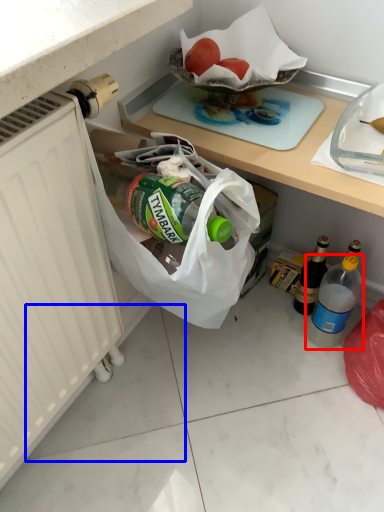
Question: Which of the following is the farthest to the observer, bottle (highlighted by a red box) or tile (highlighted by a blue box)?

Choices:
 (A) bottle
 (B) tile

Answer: (A)